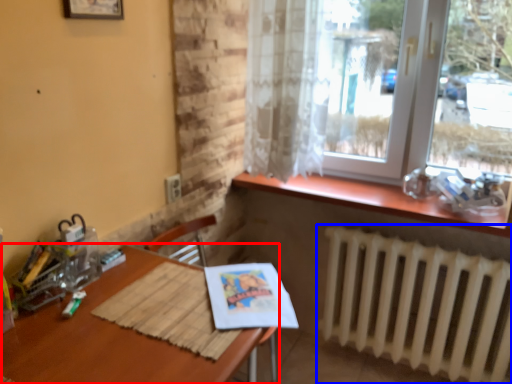
Question: Which of the following is the closest to the observer, table (highlighted by a red box) or radiator (highlighted by a blue box)?

Choices:
 (A) table
 (B) radiator

Answer: (A)